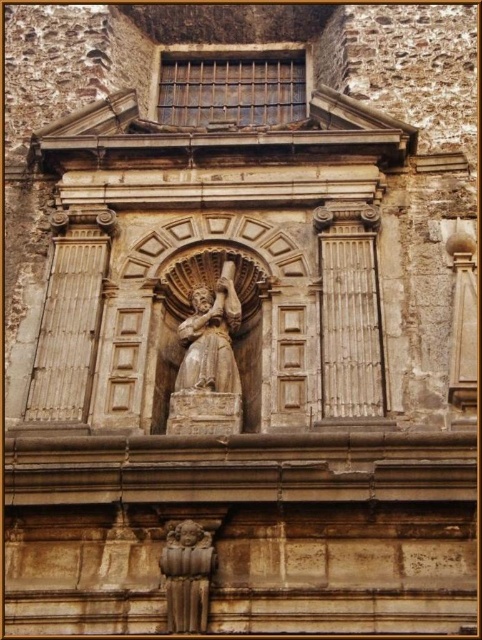
Question: Does rusty metal window at upper center lie behind brown stone cherub at lower center?

Choices:
 (A) no
 (B) yes

Answer: (B)

Question: Does rusty metal window at upper center have a lesser width compared to brown stone cherub at lower center?

Choices:
 (A) no
 (B) yes

Answer: (A)

Question: Does rusty metal window at upper center appear on the right side of brown stone cherub at lower center?

Choices:
 (A) yes
 (B) no

Answer: (A)

Question: Which of the following is the farthest from the observer?

Choices:
 (A) (186, 520)
 (B) (166, 106)

Answer: (B)

Question: Which point is closer to the camera?

Choices:
 (A) rusty metal window at upper center
 (B) brown stone cherub at lower center

Answer: (B)